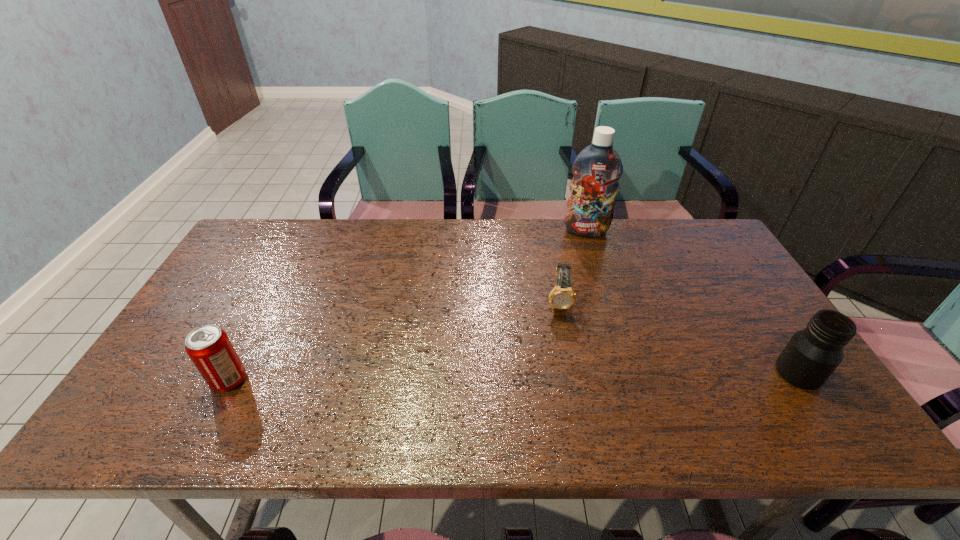
At what (x,y) coordinates should I click in order to perform the action: click on soda can. Please return your answer as a coordinate pair (x, y). Looking at the image, I should click on (209, 348).

You are a GUI agent. You are given a task and a screenshot of the screen. Output one action in this format:
    pyautogui.click(x=<x>, y=<y>)
    Task: Click on the third tallest object
    The width and height of the screenshot is (960, 540).
    Given the screenshot: What is the action you would take?
    pyautogui.click(x=209, y=348)

This screenshot has width=960, height=540. Find the location of `the rightmost object`. the rightmost object is located at coordinates (812, 354).

Identify the location of the second farthest object. click(562, 296).

This screenshot has height=540, width=960. Identify the location of the third object from right to left. (562, 296).

I want to click on the second object from right to left, so click(597, 169).

I want to click on the farthest object, so click(x=597, y=169).

Locate an element on the screen. This screenshot has width=960, height=540. free location located on the back of the leftmost object is located at coordinates (276, 289).

At what (x,y) coordinates should I click in order to perform the action: click on free region located on the back of the rightmost object. Please return your answer as a coordinate pair (x, y). Looking at the image, I should click on (740, 285).

Locate an element on the screen. vacant region located 0.220m on the face of the watch is located at coordinates (563, 384).